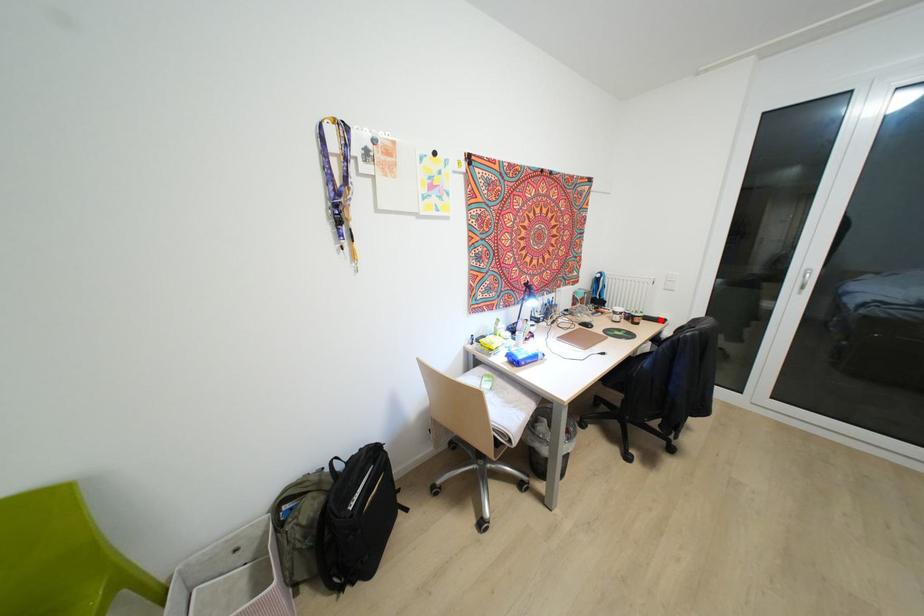
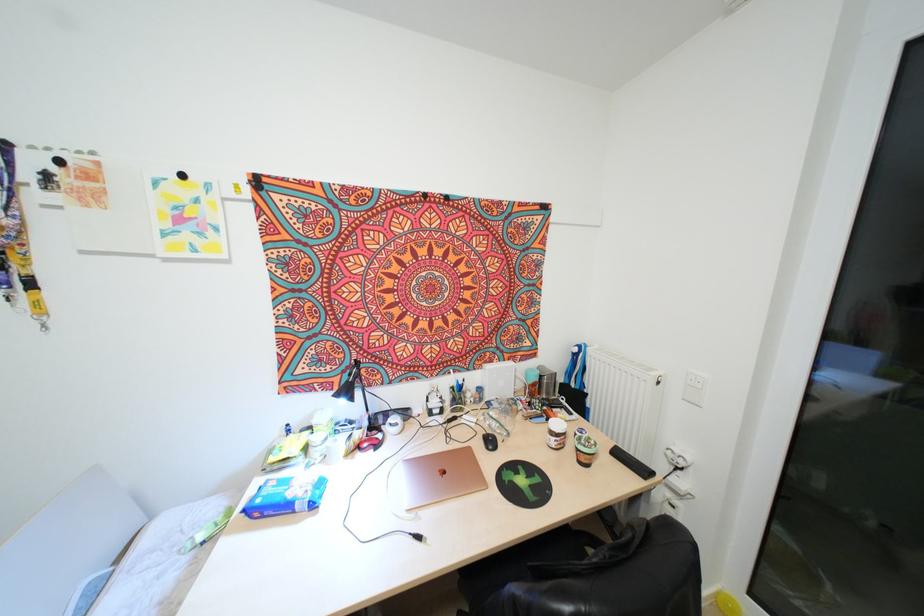
Find the pixel in the second image that matches the highlighted location in the first image.

(642, 471)